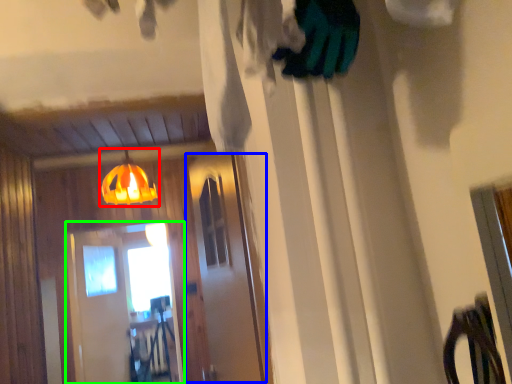
Question: Based on their relative distances, which object is farther from lamp (highlighted by a red box)? Choose from screen door (highlighted by a blue box) and screen door (highlighted by a green box).

Choices:
 (A) screen door
 (B) screen door

Answer: (A)